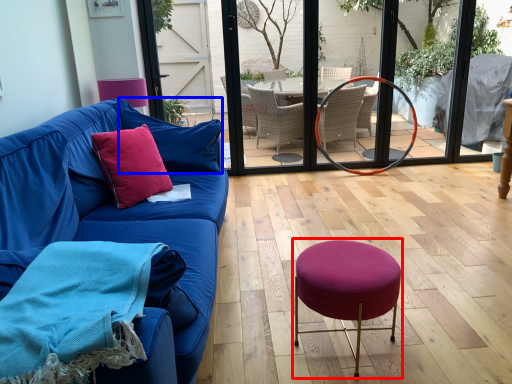
Question: Among these objects, which one is farthest to the camera, bar stool (highlighted by a red box) or pillow (highlighted by a blue box)?

Choices:
 (A) bar stool
 (B) pillow

Answer: (B)